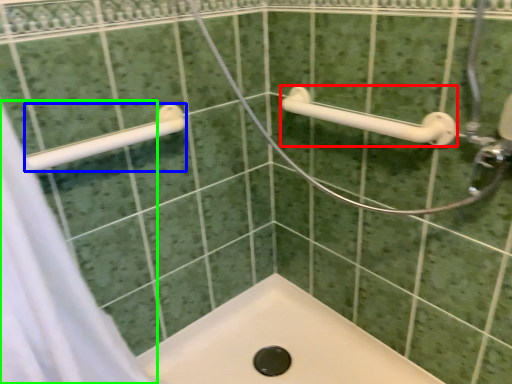
Question: Based on their relative distances, which object is nearer to towel rack (highlighted by a red box)? Choose from towel rack (highlighted by a blue box) and shower curtain (highlighted by a green box).

Choices:
 (A) towel rack
 (B) shower curtain

Answer: (A)